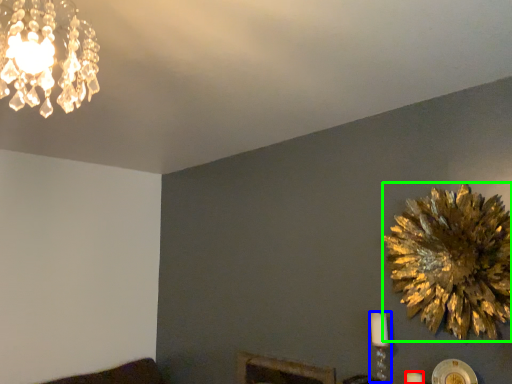
Question: Estimate the real-world distances between objects in this image. Which object is farther from candle (highlighted by a red box), candle holder (highlighted by a blue box) or flower (highlighted by a green box)?

Choices:
 (A) candle holder
 (B) flower

Answer: (B)